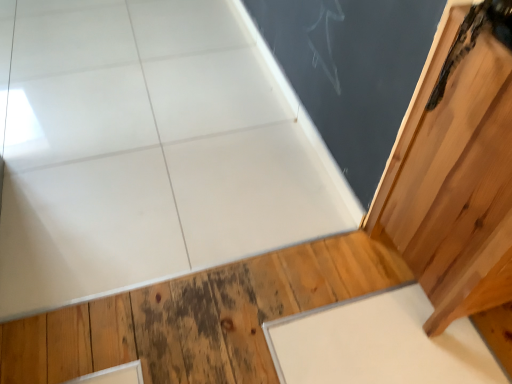
Where is `vacant space behind white matte slate at lower right`? The image size is (512, 384). vacant space behind white matte slate at lower right is located at coordinates (338, 269).